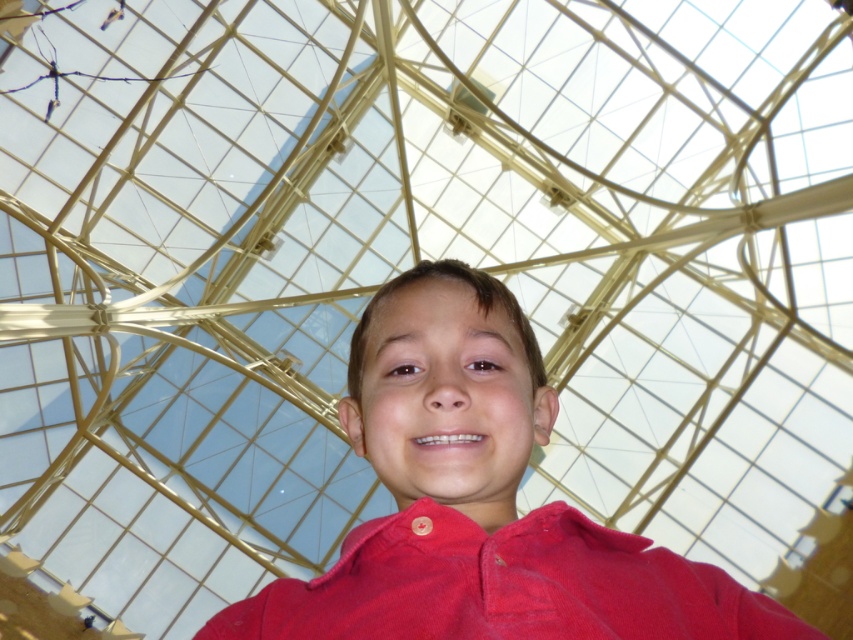
Question: Does red matte shirt at center appear under red corduroy polo shirt at center?

Choices:
 (A) no
 (B) yes

Answer: (A)

Question: Does red matte shirt at center have a larger size compared to red corduroy polo shirt at center?

Choices:
 (A) no
 (B) yes

Answer: (B)

Question: Can you confirm if red matte shirt at center is positioned to the left of red corduroy polo shirt at center?

Choices:
 (A) no
 (B) yes

Answer: (B)

Question: Which of the following is the closest to the observer?

Choices:
 (A) (463, 570)
 (B) (399, 577)

Answer: (A)